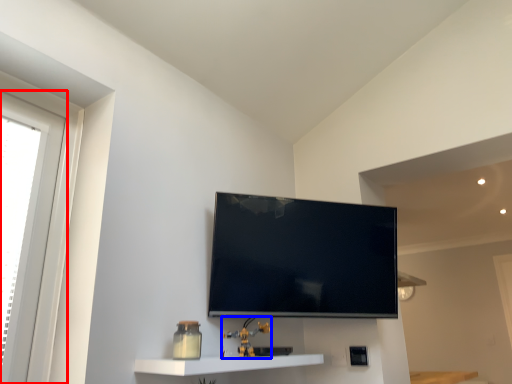
Question: Which point is closer to the camera, window (highlighted by a red box) or toy (highlighted by a blue box)?

Choices:
 (A) window
 (B) toy

Answer: (A)